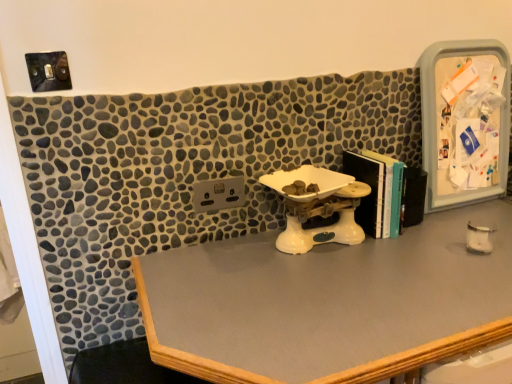
Locate an element on the screen. This screenshot has width=512, height=384. vacant area located to the right-hand side of white plastic scale at center is located at coordinates (423, 255).